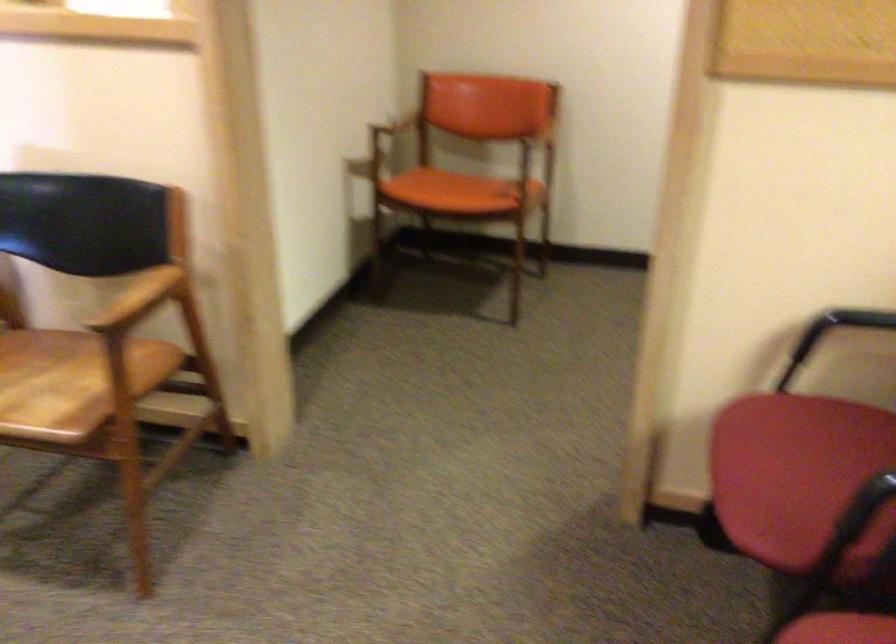
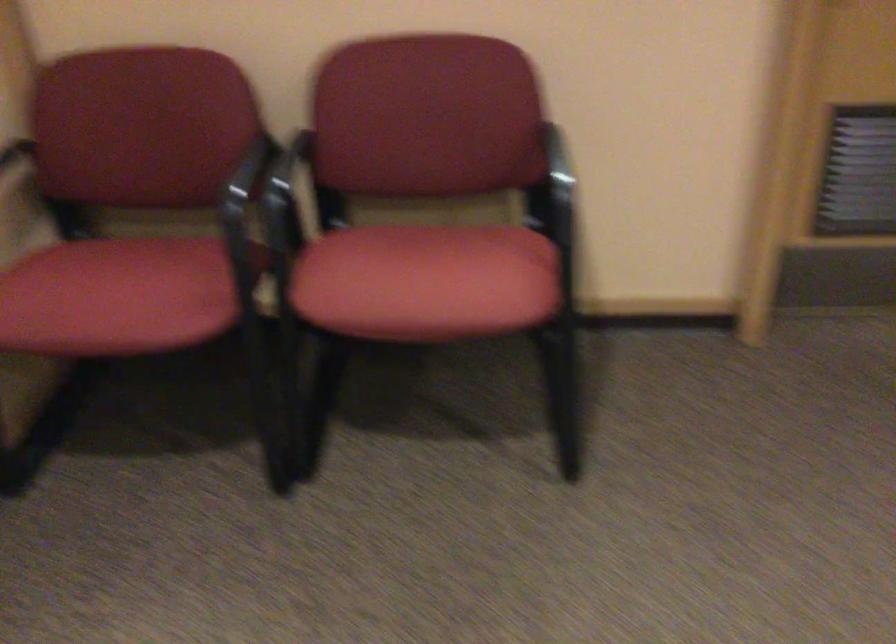
Where in the second image is the point corresponding to point (776, 460) from the first image?

(116, 297)